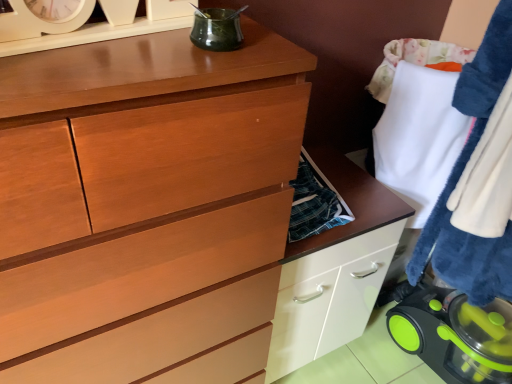
Question: From a real-world perspective, is green glass jar at upper center, which is counted as the first appliance, starting from the front, located higher than green plastic vacuum cleaner at lower right, which is the second appliance in top-to-bottom order?

Choices:
 (A) no
 (B) yes

Answer: (B)

Question: Can you confirm if green glass jar at upper center, arranged as the first appliance when viewed from the top, is positioned to the left of green plastic vacuum cleaner at lower right, which is the 2th appliance from front to back?

Choices:
 (A) no
 (B) yes

Answer: (B)

Question: Is green plastic vacuum cleaner at lower right, arranged as the 1th appliance when viewed from the right, surrounded by green glass jar at upper center, which appears as the second appliance when viewed from the right?

Choices:
 (A) yes
 (B) no

Answer: (B)

Question: Considering the relative sizes of green glass jar at upper center, positioned as the 1th appliance in left-to-right order, and green plastic vacuum cleaner at lower right, which is the second appliance in top-to-bottom order, in the image provided, is green glass jar at upper center, positioned as the 1th appliance in left-to-right order, wider than green plastic vacuum cleaner at lower right, which is the second appliance in top-to-bottom order,?

Choices:
 (A) yes
 (B) no

Answer: (B)

Question: From a real-world perspective, is green glass jar at upper center, the second appliance viewed from the back, beneath green plastic vacuum cleaner at lower right, which is the 1th appliance from back to front?

Choices:
 (A) no
 (B) yes

Answer: (A)

Question: Does green glass jar at upper center, the 2th appliance from the bottom, have a smaller size compared to green plastic vacuum cleaner at lower right, which is the 1th appliance from back to front?

Choices:
 (A) no
 (B) yes

Answer: (B)

Question: From the image's perspective, is white fluffy towel at right below green glass jar at upper center, which is counted as the first appliance, starting from the front?

Choices:
 (A) yes
 (B) no

Answer: (A)

Question: Can you confirm if white fluffy towel at right is taller than green glass jar at upper center, arranged as the first appliance when viewed from the top?

Choices:
 (A) no
 (B) yes

Answer: (B)

Question: From the image's perspective, is white fluffy towel at right located above green glass jar at upper center, which appears as the second appliance when viewed from the right?

Choices:
 (A) yes
 (B) no

Answer: (B)

Question: Is white fluffy towel at right beside green glass jar at upper center, which is counted as the first appliance, starting from the front?

Choices:
 (A) yes
 (B) no

Answer: (B)

Question: Is white fluffy towel at right turned away from green glass jar at upper center, the 2th appliance from the bottom?

Choices:
 (A) yes
 (B) no

Answer: (B)

Question: Does white fluffy towel at right appear on the left side of green glass jar at upper center, which is counted as the first appliance, starting from the front?

Choices:
 (A) no
 (B) yes

Answer: (A)

Question: From the image's perspective, is green plastic vacuum cleaner at lower right, which is the 1th appliance from back to front, below white fluffy towel at right?

Choices:
 (A) yes
 (B) no

Answer: (A)